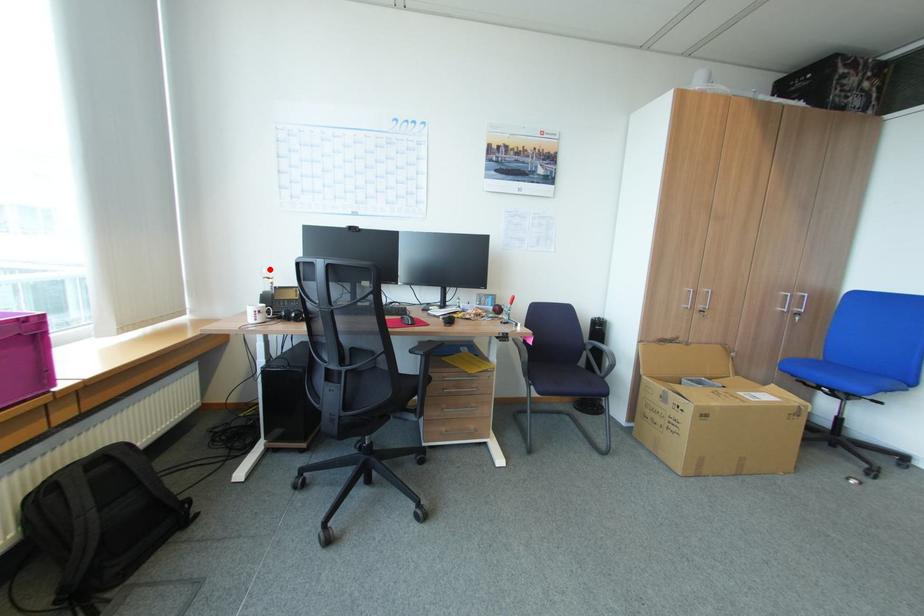
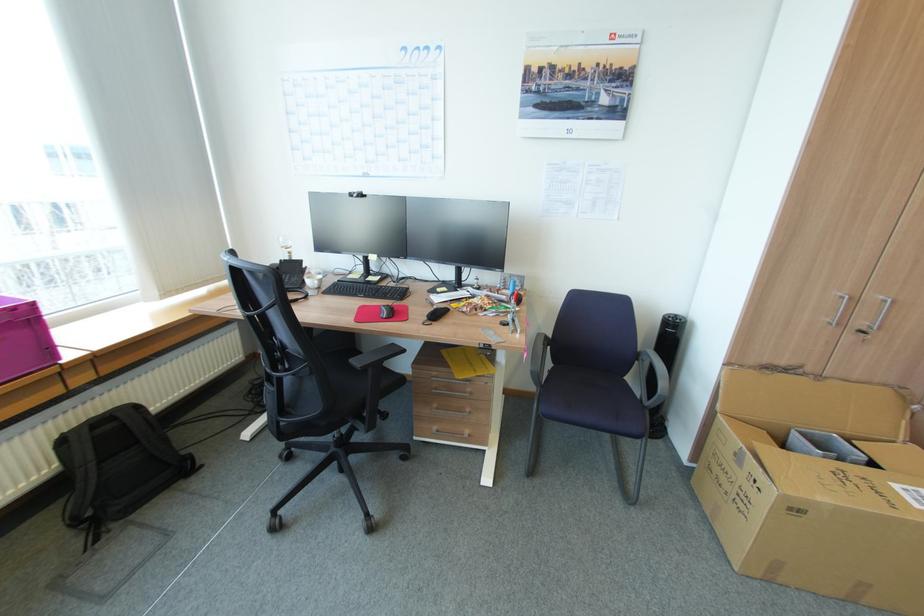
Find the pixel in the second image that matches the highlighted location in the first image.

(286, 238)